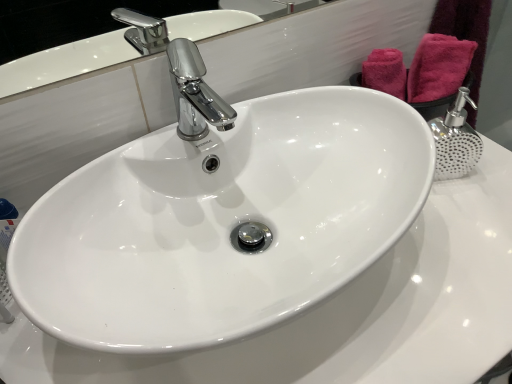
Find the location of a particular element. pink fabric towel at upper right is located at coordinates (438, 67).

The height and width of the screenshot is (384, 512). Describe the element at coordinates (438, 67) in the screenshot. I see `pink fabric towel at upper right` at that location.

What do you see at coordinates (222, 222) in the screenshot? I see `white glossy sink at center` at bounding box center [222, 222].

Find the location of a particular element. This screenshot has height=384, width=512. white glossy sink at center is located at coordinates (222, 222).

The height and width of the screenshot is (384, 512). I want to click on pink fabric towel at upper right, so click(438, 67).

Does pink fabric towel at upper right appear on the right side of white glossy sink at center?

Yes.

Is pink fabric towel at upper right in front of white glossy sink at center?

No, it is behind white glossy sink at center.

Considering the positions of points (424, 99) and (227, 258), is point (424, 99) closer to camera compared to point (227, 258)?

No, it is not.

From the image's perspective, which one is positioned higher, pink fabric towel at upper right or white glossy sink at center?

pink fabric towel at upper right.

From the picture: From a real-world perspective, is pink fabric towel at upper right above or below white glossy sink at center?

Clearly, from a real-world perspective, pink fabric towel at upper right is above white glossy sink at center.

Looking at their sizes, would you say pink fabric towel at upper right is wider or thinner than white glossy sink at center?

Considering their sizes, pink fabric towel at upper right looks slimmer than white glossy sink at center.

Considering the relative sizes of pink fabric towel at upper right and white glossy sink at center in the image provided, is pink fabric towel at upper right shorter than white glossy sink at center?

Indeed, pink fabric towel at upper right has a lesser height compared to white glossy sink at center.

Looking at the image, does pink fabric towel at upper right seem bigger or smaller compared to white glossy sink at center?

In the image, pink fabric towel at upper right appears to be smaller than white glossy sink at center.

Is pink fabric towel at upper right not within white glossy sink at center?

Yes, pink fabric towel at upper right is outside of white glossy sink at center.

Is the surface of pink fabric towel at upper right in direct contact with white glossy sink at center?

pink fabric towel at upper right is not next to white glossy sink at center, and they're not touching.

Is pink fabric towel at upper right oriented towards white glossy sink at center?

Yes.

Based on the photo, can you tell me how much pink fabric towel at upper right and white glossy sink at center differ in facing direction?

The angle between the facing direction of pink fabric towel at upper right and the facing direction of white glossy sink at center is 57.9 degrees.

The width and height of the screenshot is (512, 384). I want to click on bath towel located on the right of white glossy sink at center, so click(x=438, y=67).

In the scene shown: Would you say white glossy sink at center is to the left or to the right of pink fabric towel at upper right in the picture?

From the image, it's evident that white glossy sink at center is to the left of pink fabric towel at upper right.

Consider the image. Is white glossy sink at center in front of or behind pink fabric towel at upper right in the image?

In the image, white glossy sink at center appears in front of pink fabric towel at upper right.

Does point (290, 175) come behind point (426, 41)?

No, (290, 175) is closer to viewer.

In the scene shown: From the image's perspective, who appears lower, white glossy sink at center or pink fabric towel at upper right?

white glossy sink at center appears lower in the image.

From a real-world perspective, relative to pink fabric towel at upper right, is white glossy sink at center vertically above or below?

white glossy sink at center is situated lower than pink fabric towel at upper right in the real world.

Is white glossy sink at center wider or thinner than pink fabric towel at upper right?

white glossy sink at center is wider than pink fabric towel at upper right.

Considering the relative sizes of white glossy sink at center and pink fabric towel at upper right in the image provided, is white glossy sink at center taller than pink fabric towel at upper right?

Yes.

Consider the image. Considering the sizes of white glossy sink at center and pink fabric towel at upper right in the image, is white glossy sink at center bigger or smaller than pink fabric towel at upper right?

Clearly, white glossy sink at center is larger in size than pink fabric towel at upper right.

Could pink fabric towel at upper right be considered to be inside white glossy sink at center?

No, pink fabric towel at upper right is not a part of white glossy sink at center.

Is white glossy sink at center next to pink fabric towel at upper right?

No, white glossy sink at center is not in contact with pink fabric towel at upper right.

Does white glossy sink at center turn towards pink fabric towel at upper right?

No, white glossy sink at center is not turned towards pink fabric towel at upper right.

You are a GUI agent. You are given a task and a screenshot of the screen. Output one action in this format:
    pyautogui.click(x=<x>, y=<y>)
    Task: Click on the sink to the left of pink fabric towel at upper right
    The width and height of the screenshot is (512, 384).
    Given the screenshot: What is the action you would take?
    pyautogui.click(x=222, y=222)

At what (x,y) coordinates should I click in order to perform the action: click on sink lying on the left of pink fabric towel at upper right. Please return your answer as a coordinate pair (x, y). This screenshot has width=512, height=384. Looking at the image, I should click on (222, 222).

The image size is (512, 384). I want to click on sink in front of the pink fabric towel at upper right, so click(x=222, y=222).